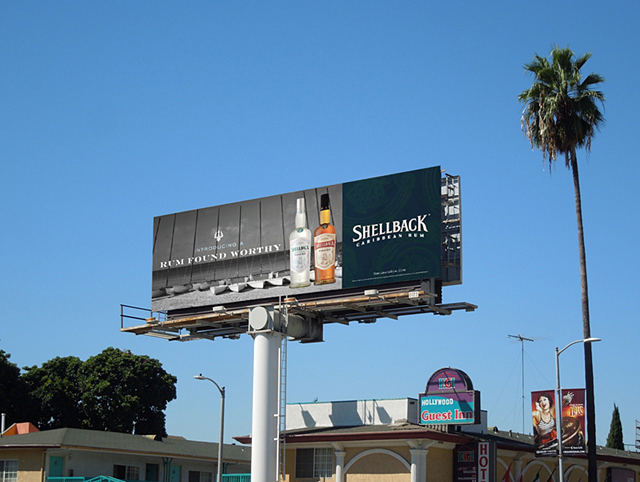
Where is `bottle`? The image size is (640, 482). bottle is located at coordinates (291, 233).